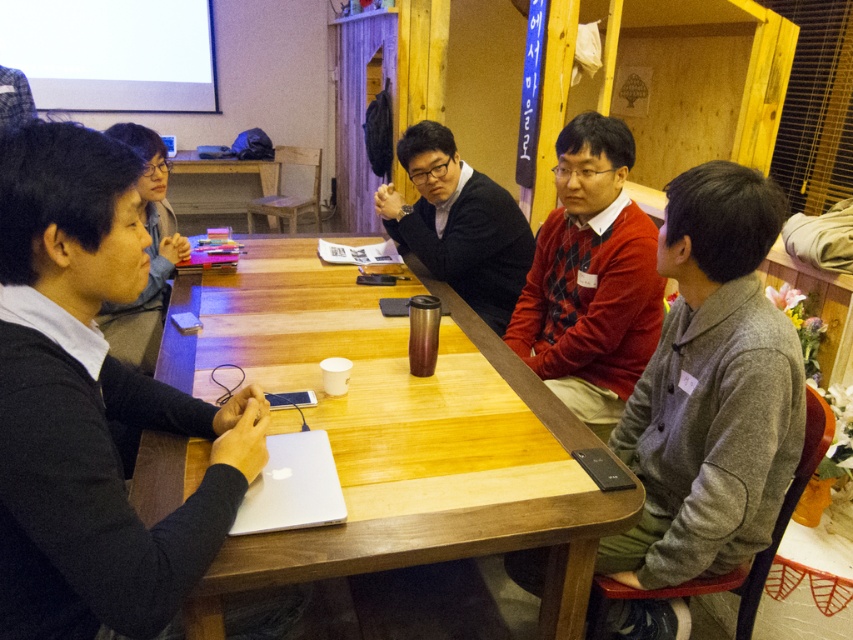
Question: Which point is closer to the camera?

Choices:
 (A) light brown wooden table at center
 (B) black matte sweater at left
 (C) matte black shirt at center
 (D) wooden table at center

Answer: (B)

Question: In this image, where is light brown wooden table at center located relative to black matte sweater at left?

Choices:
 (A) below
 (B) above

Answer: (B)

Question: Which object is farther from the camera taking this photo?

Choices:
 (A) light brown wooden table at center
 (B) silver metallic laptop at upper left
 (C) matte black shirt at center

Answer: (B)

Question: Which point is closer to the camera?

Choices:
 (A) wooden table at center
 (B) light brown wooden table at center
 (C) red sweater at center
 (D) silver metallic laptop at upper left

Answer: (B)

Question: Is matte black shirt at center thinner than silver metallic laptop at upper left?

Choices:
 (A) no
 (B) yes

Answer: (A)

Question: Is black matte sweater at left further to the viewer compared to matte black shirt at center?

Choices:
 (A) no
 (B) yes

Answer: (A)